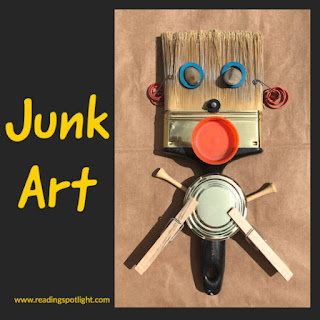
Find the location of a particular element. This screenshot has height=320, width=320. countertop is located at coordinates (160, 294).